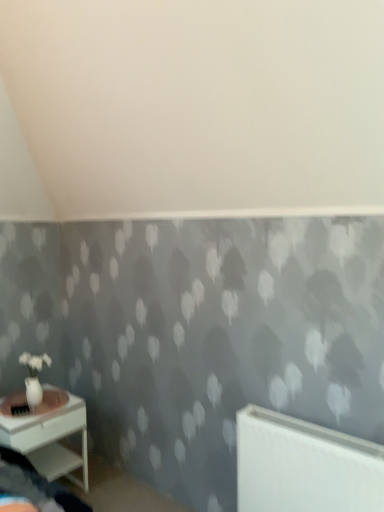
Question: Is white glossy nightstand at lower left inside white matte radiator at lower right?

Choices:
 (A) yes
 (B) no

Answer: (B)

Question: From a real-world perspective, is white matte radiator at lower right on white glossy nightstand at lower left?

Choices:
 (A) no
 (B) yes

Answer: (B)

Question: Considering the relative positions of white matte radiator at lower right and white glossy nightstand at lower left in the image provided, is white matte radiator at lower right to the left of white glossy nightstand at lower left from the viewer's perspective?

Choices:
 (A) no
 (B) yes

Answer: (A)

Question: Can you confirm if white matte radiator at lower right is positioned to the right of white glossy nightstand at lower left?

Choices:
 (A) yes
 (B) no

Answer: (A)

Question: From a real-world perspective, is white matte radiator at lower right located beneath white glossy nightstand at lower left?

Choices:
 (A) no
 (B) yes

Answer: (A)

Question: Can you confirm if white matte radiator at lower right is thinner than white glossy nightstand at lower left?

Choices:
 (A) yes
 (B) no

Answer: (A)

Question: Could you tell me if white glossy nightstand at lower left is turned towards white matte radiator at lower right?

Choices:
 (A) no
 (B) yes

Answer: (B)

Question: Considering the relative sizes of white glossy nightstand at lower left and white matte radiator at lower right in the image provided, is white glossy nightstand at lower left bigger than white matte radiator at lower right?

Choices:
 (A) no
 (B) yes

Answer: (B)

Question: Is white glossy nightstand at lower left touching white matte radiator at lower right?

Choices:
 (A) yes
 (B) no

Answer: (B)

Question: Can white matte radiator at lower right be found inside white glossy nightstand at lower left?

Choices:
 (A) no
 (B) yes

Answer: (A)

Question: Does white glossy nightstand at lower left lie in front of white matte radiator at lower right?

Choices:
 (A) yes
 (B) no

Answer: (B)

Question: From a real-world perspective, is white glossy nightstand at lower left physically below white matte radiator at lower right?

Choices:
 (A) no
 (B) yes

Answer: (B)

Question: Is white matte radiator at lower right in front of or behind white glossy nightstand at lower left in the image?

Choices:
 (A) behind
 (B) front

Answer: (B)